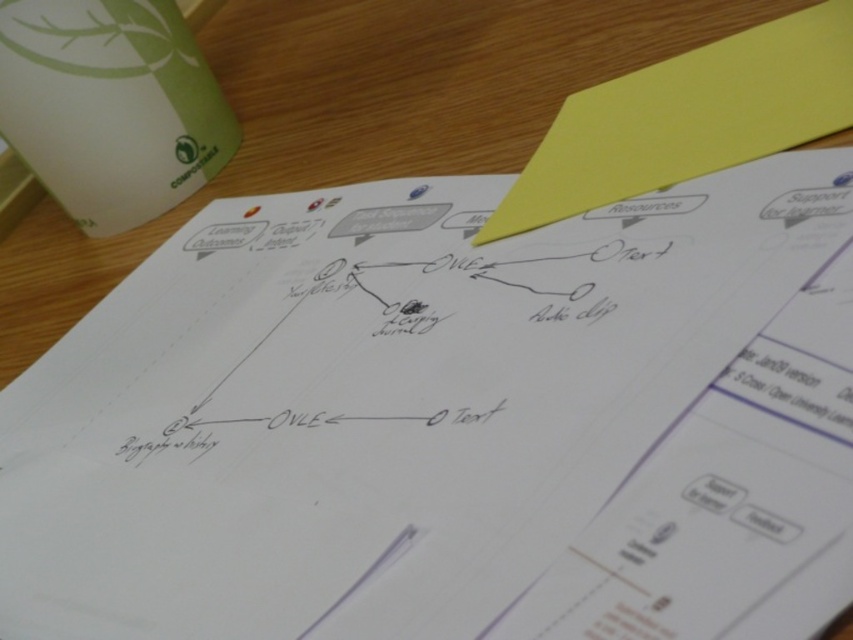
You are organizing a workshop and need to place the green matte cup at upper left and the yellow paper at upper right on a table. If you want to ensure both items are visible, which item should you place closer to the edge of the table?

The green matte cup at upper left should be placed closer to the edge of the table because it is smaller than the yellow paper at upper right, allowing both items to remain visible without overlapping.

You are looking at the printed document on the wooden surface. There are two points marked on the diagram. The first point is at coordinate point [65,173] and the second is at point [523,180]. Which point is closer to you?

Point [65,173] is closer to you because it is further to the viewer than point [523,180].

You are organizing a study session and need to access the flowchart on the document. However, the green matte cup at upper left and the yellow paper at upper right are blocking your view. Which object is closer to you, making it the primary obstruction?

The green matte cup at upper left is closer to you because the yellow paper at upper right is behind it, so the green matte cup at upper left is the primary obstruction.